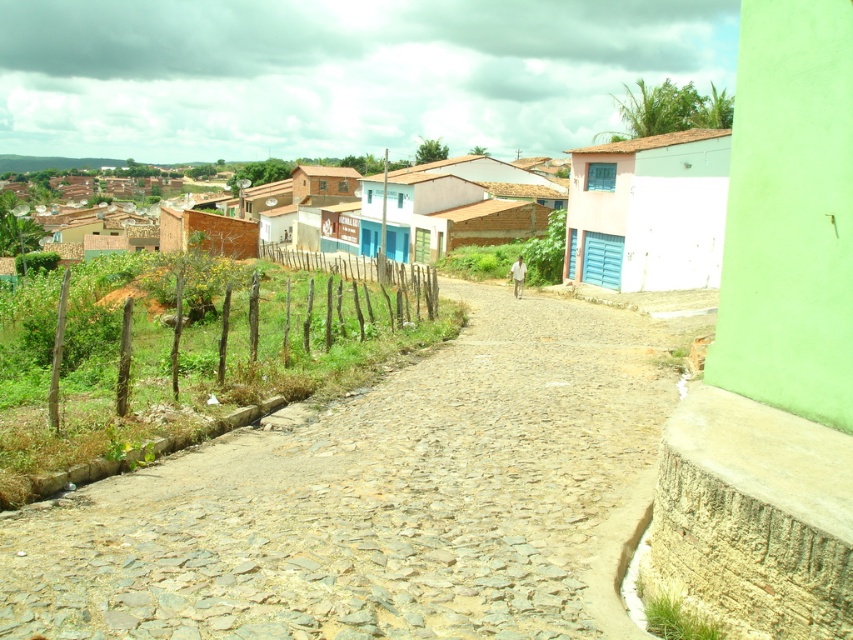
Who is shorter, brown cobblestone dirt track at center or white painted wood hut at center-right?

brown cobblestone dirt track at center is shorter.

Between brown cobblestone dirt track at center and white painted wood hut at center-right, which one is positioned higher?

white painted wood hut at center-right is above.

Does point (561, 346) come farther from viewer compared to point (651, 198)?

No, it is not.

Locate an element on the screen. The image size is (853, 640). brown cobblestone dirt track at center is located at coordinates (373, 497).

Does point (257, 461) come in front of point (502, 177)?

Yes, it is in front of point (502, 177).

In the scene shown: Does brown cobblestone dirt track at center appear over white painted brick house at center?

Incorrect, brown cobblestone dirt track at center is not positioned above white painted brick house at center.

Who is more forward, (490, 394) or (399, 184)?

Positioned in front is point (490, 394).

Locate an element on the screen. The image size is (853, 640). brown cobblestone dirt track at center is located at coordinates pos(373,497).

Does white painted wood hut at center-right have a lesser width compared to white painted brick house at center?

Yes, white painted wood hut at center-right is thinner than white painted brick house at center.

Does white painted wood hut at center-right lie in front of white painted brick house at center?

Yes, white painted wood hut at center-right is closer to the viewer.

Identify the location of white painted wood hut at center-right. (648, 211).